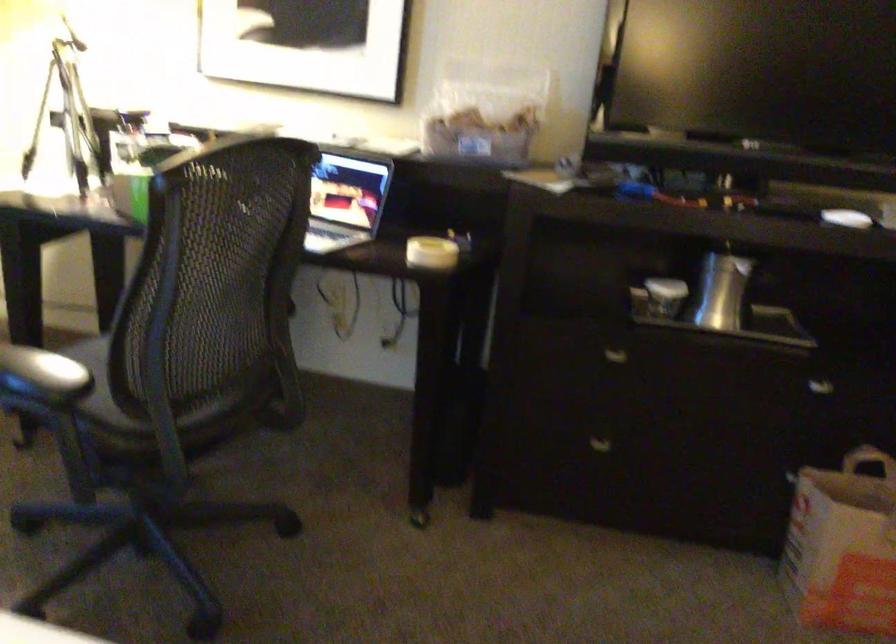
Image resolution: width=896 pixels, height=644 pixels. What are the coordinates of `white roll of tape` in the screenshot? It's located at (431, 252).